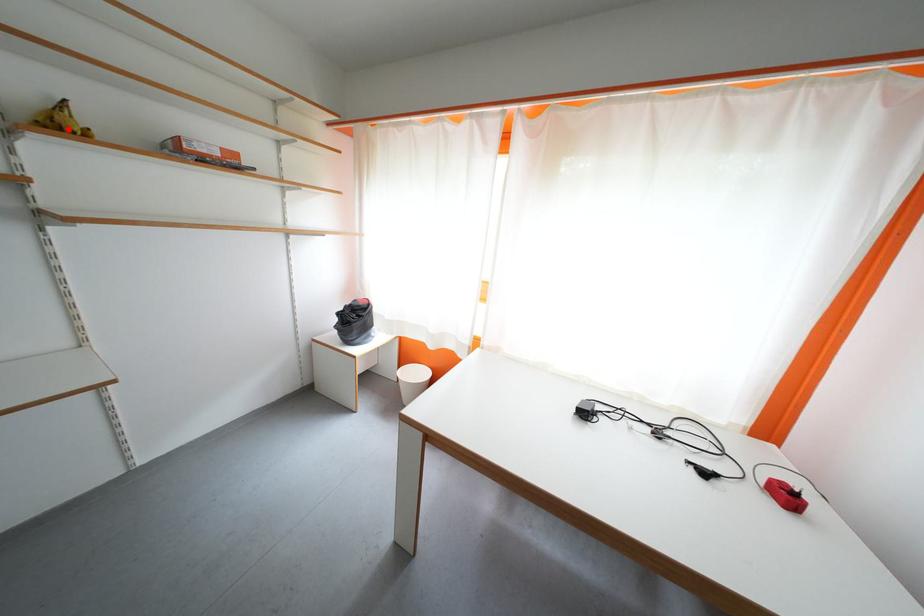
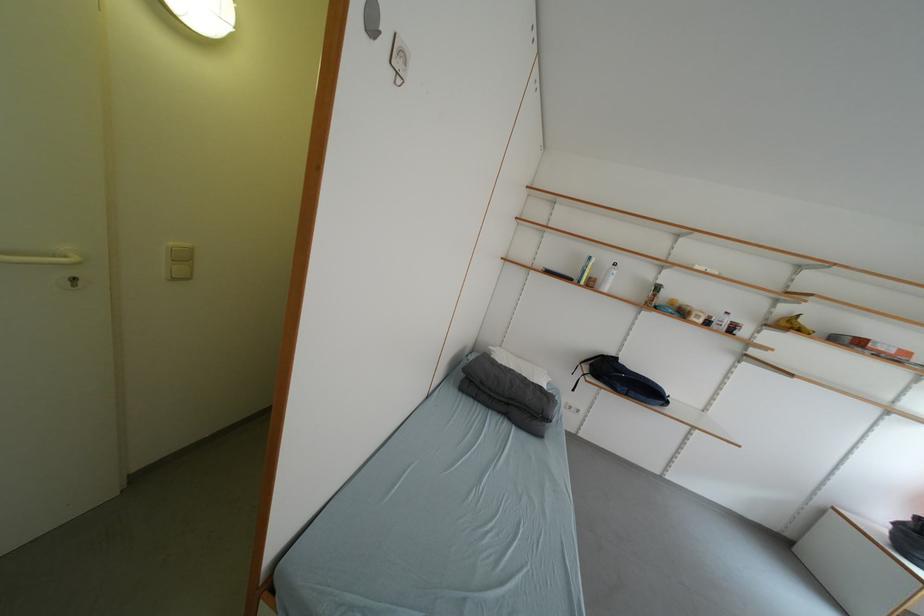
Find the pixel in the second image that matches the highlighted location in the first image.

(797, 328)